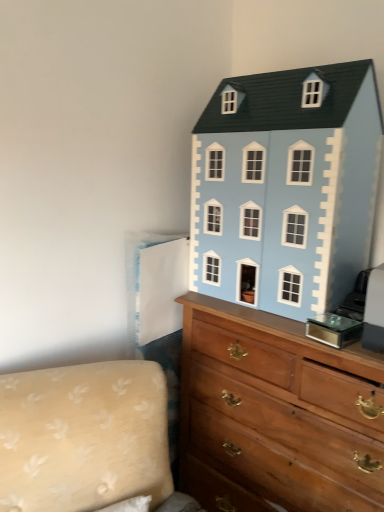
Question: Considering the relative sizes of light blue painted wood dollhouse at upper right and wooden chest of drawers at upper right in the image provided, is light blue painted wood dollhouse at upper right bigger than wooden chest of drawers at upper right?

Choices:
 (A) yes
 (B) no

Answer: (B)

Question: From a real-world perspective, is light blue painted wood dollhouse at upper right positioned over wooden chest of drawers at upper right based on gravity?

Choices:
 (A) no
 (B) yes

Answer: (B)

Question: Considering the relative sizes of light blue painted wood dollhouse at upper right and wooden chest of drawers at upper right in the image provided, is light blue painted wood dollhouse at upper right taller than wooden chest of drawers at upper right?

Choices:
 (A) yes
 (B) no

Answer: (B)

Question: Does light blue painted wood dollhouse at upper right have a lesser height compared to wooden chest of drawers at upper right?

Choices:
 (A) yes
 (B) no

Answer: (A)

Question: Is wooden chest of drawers at upper right inside light blue painted wood dollhouse at upper right?

Choices:
 (A) no
 (B) yes

Answer: (A)

Question: From a real-world perspective, relative to light blue painted wood dollhouse at upper right, is wooden chest of drawers at upper right vertically above or below?

Choices:
 (A) above
 (B) below

Answer: (B)

Question: Is point (375, 463) positioned closer to the camera than point (357, 133)?

Choices:
 (A) farther
 (B) closer

Answer: (B)

Question: Is wooden chest of drawers at upper right wider or thinner than light blue painted wood dollhouse at upper right?

Choices:
 (A) wide
 (B) thin

Answer: (A)

Question: Relative to light blue painted wood dollhouse at upper right, is wooden chest of drawers at upper right in front or behind?

Choices:
 (A) front
 (B) behind

Answer: (A)

Question: In terms of width, does beige fabric couch at lower left look wider or thinner when compared to wooden chest of drawers at upper right?

Choices:
 (A) thin
 (B) wide

Answer: (B)

Question: Considering the positions of beige fabric couch at lower left and wooden chest of drawers at upper right in the image, is beige fabric couch at lower left taller or shorter than wooden chest of drawers at upper right?

Choices:
 (A) short
 (B) tall

Answer: (A)

Question: Is point (99, 422) closer or farther from the camera than point (192, 350)?

Choices:
 (A) closer
 (B) farther

Answer: (A)

Question: Is beige fabric couch at lower left bigger or smaller than wooden chest of drawers at upper right?

Choices:
 (A) big
 (B) small

Answer: (B)

Question: Is light blue painted wood dollhouse at upper right bigger or smaller than beige fabric couch at lower left?

Choices:
 (A) big
 (B) small

Answer: (B)

Question: Relative to beige fabric couch at lower left, is light blue painted wood dollhouse at upper right in front or behind?

Choices:
 (A) behind
 (B) front

Answer: (A)